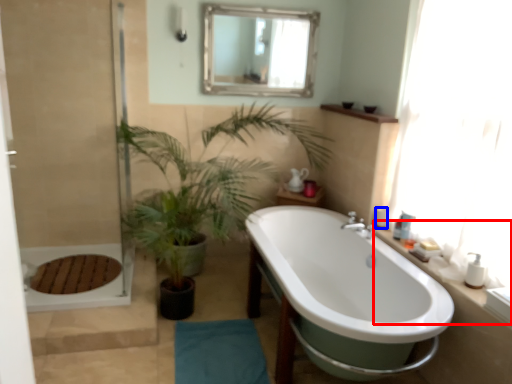
Question: Which of the following is the closest to the observer, counter top (highlighted by a red box) or toiletry (highlighted by a blue box)?

Choices:
 (A) counter top
 (B) toiletry

Answer: (A)